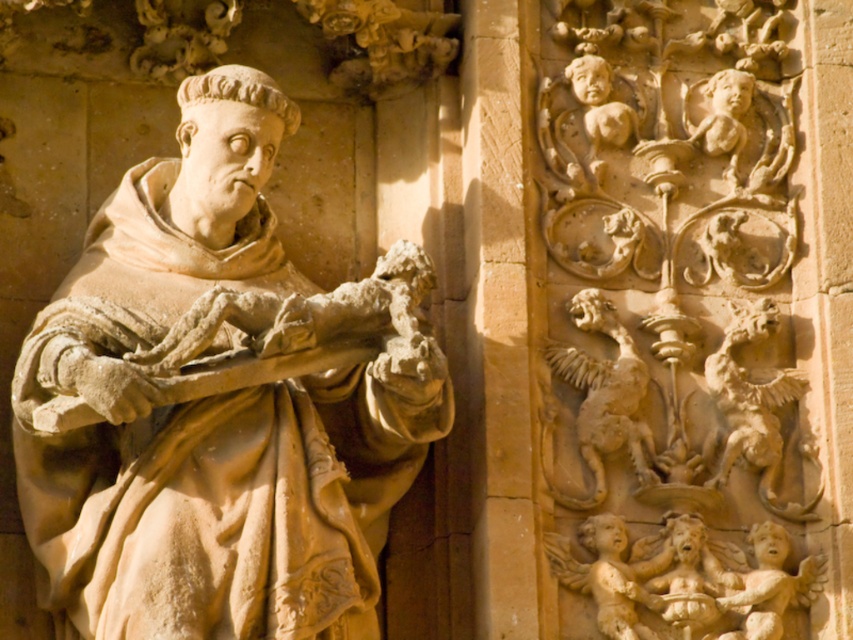
Question: Which point is closer to the camera?

Choices:
 (A) (631, 360)
 (B) (698, 612)

Answer: (B)

Question: Can you confirm if carved stone lion at upper right is smaller than smooth beige cherub at right?

Choices:
 (A) no
 (B) yes

Answer: (B)

Question: Is beige stone statue at center to the left of smooth beige cherub at lower right from the viewer's perspective?

Choices:
 (A) no
 (B) yes

Answer: (B)

Question: Estimate the real-world distances between objects in this image. Which object is closer to the carved stone griffin at upper right?

Choices:
 (A) carved stone lion at upper right
 (B) smooth beige cherub at lower right
 (C) beige stone statue at center

Answer: (A)

Question: Is beige stone cherubim at upper right thinner than smooth stone cherub at lower right?

Choices:
 (A) no
 (B) yes

Answer: (A)

Question: Which point is closer to the camera?

Choices:
 (A) smooth beige cherub at right
 (B) carved stone griffin at upper right

Answer: (A)